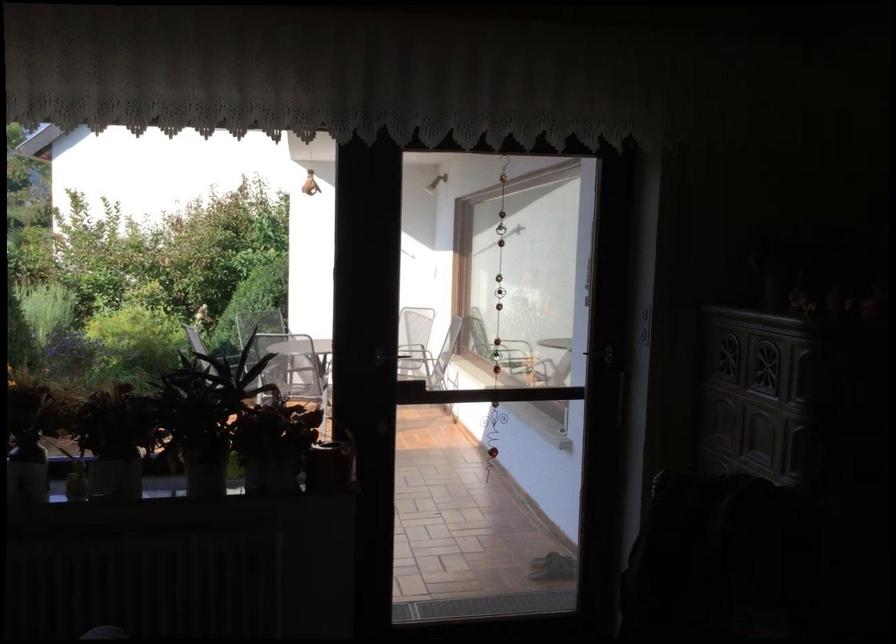
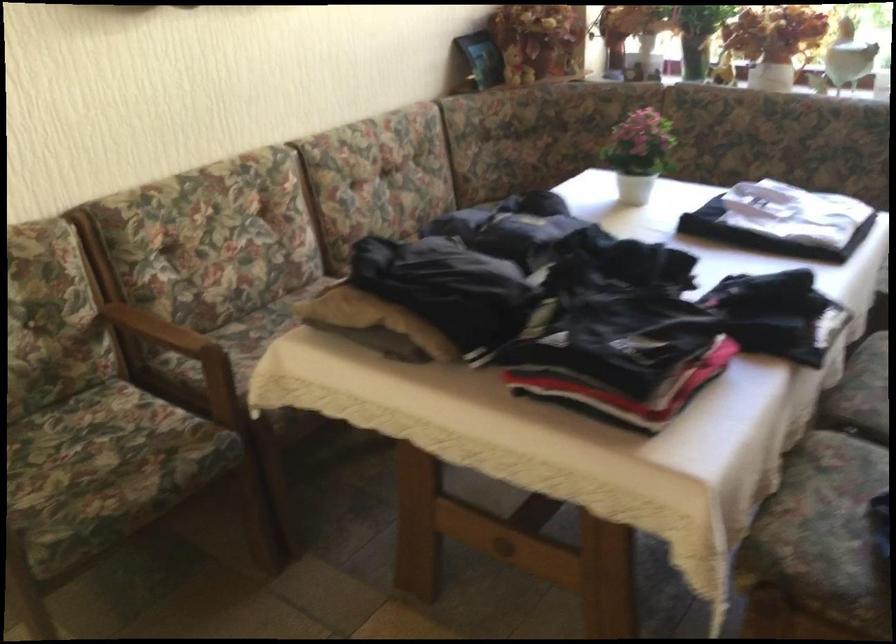
The first image is from the beginning of the video and the second image is from the end. How did the camera likely rotate when shooting the video?

The camera's rotation is toward left-down.